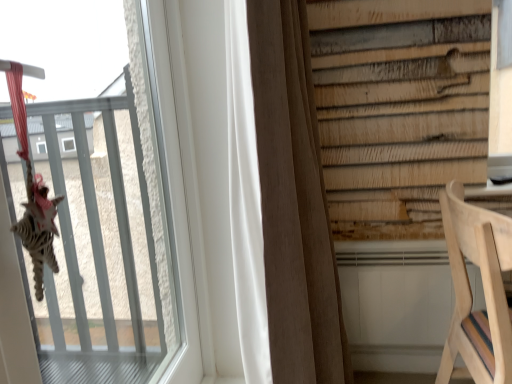
The width and height of the screenshot is (512, 384). What do you see at coordinates (109, 225) in the screenshot?
I see `transparent glass window at upper left` at bounding box center [109, 225].

You are a GUI agent. You are given a task and a screenshot of the screen. Output one action in this format:
    pyautogui.click(x=<x>, y=<y>)
    Task: Click on the natural wood chair at lower right
    
    Given the screenshot: What is the action you would take?
    pyautogui.click(x=471, y=292)

Find the location of a particular element. brown fabric curtain at center is located at coordinates (294, 202).

Which is more to the right, transparent glass window at upper left or brown fabric curtain at center?

brown fabric curtain at center is more to the right.

Can you confirm if transparent glass window at upper left is thinner than brown fabric curtain at center?

Yes.

Looking at this image, considering the sizes of objects transparent glass window at upper left and brown fabric curtain at center in the image provided, who is smaller, transparent glass window at upper left or brown fabric curtain at center?

transparent glass window at upper left.

Can you confirm if transparent glass window at upper left is taller than brown fabric curtain at center?

In fact, transparent glass window at upper left may be shorter than brown fabric curtain at center.

From the image's perspective, is transparent glass window at upper left located above or below natural wood chair at lower right?

transparent glass window at upper left is above natural wood chair at lower right.

Which object is positioned more to the right, transparent glass window at upper left or natural wood chair at lower right?

Positioned to the right is natural wood chair at lower right.

Considering the points (90, 210) and (488, 293), which point is behind, point (90, 210) or point (488, 293)?

Point (90, 210)

From the picture: Is brown fabric curtain at center in front of or behind natural wood chair at lower right in the image?

brown fabric curtain at center is positioned farther from the viewer than natural wood chair at lower right.

In the scene shown: Considering the relative sizes of brown fabric curtain at center and natural wood chair at lower right in the image provided, is brown fabric curtain at center bigger than natural wood chair at lower right?

Correct, brown fabric curtain at center is larger in size than natural wood chair at lower right.

Who is shorter, brown fabric curtain at center or natural wood chair at lower right?

natural wood chair at lower right is shorter.

Which object is thinner, brown fabric curtain at center or natural wood chair at lower right?

Thinner between the two is brown fabric curtain at center.

Based on their sizes in the image, would you say natural wood chair at lower right is bigger or smaller than brown fabric curtain at center?

Considering their sizes, natural wood chair at lower right takes up less space than brown fabric curtain at center.

Where is `furniture below the brown fabric curtain at center (from a real-world perspective)`? furniture below the brown fabric curtain at center (from a real-world perspective) is located at coordinates (471, 292).

Is natural wood chair at lower right far away from brown fabric curtain at center?

natural wood chair at lower right is actually quite close to brown fabric curtain at center.

Considering the positions of objects natural wood chair at lower right and brown fabric curtain at center in the image provided, who is in front, natural wood chair at lower right or brown fabric curtain at center?

natural wood chair at lower right is closer to the camera.

Between brown fabric curtain at center and transparent glass window at upper left, which one has less height?

Standing shorter between the two is transparent glass window at upper left.

This screenshot has height=384, width=512. I want to click on curtain behind the transparent glass window at upper left, so click(294, 202).

From a real-world perspective, is brown fabric curtain at center physically located above or below transparent glass window at upper left?

From a real-world perspective, brown fabric curtain at center is physically below transparent glass window at upper left.

Is natural wood chair at lower right outside of transparent glass window at upper left?

natural wood chair at lower right lies outside transparent glass window at upper left's area.

Which of these two, natural wood chair at lower right or transparent glass window at upper left, stands taller?

Standing taller between the two is transparent glass window at upper left.

Can you tell me how much natural wood chair at lower right and transparent glass window at upper left differ in facing direction?

The angular difference between natural wood chair at lower right and transparent glass window at upper left is 3.42 degrees.

Are natural wood chair at lower right and transparent glass window at upper left beside each other?

natural wood chair at lower right is not next to transparent glass window at upper left, and they're not touching.

Identify the location of curtain that appears behind the transparent glass window at upper left. The image size is (512, 384). (294, 202).

Locate an element on the screen. The height and width of the screenshot is (384, 512). window located in front of the natural wood chair at lower right is located at coordinates (109, 225).

Considering their positions, is transparent glass window at upper left positioned closer to natural wood chair at lower right than brown fabric curtain at center?

brown fabric curtain at center is positioned closer to the anchor natural wood chair at lower right.

Based on their spatial positions, is natural wood chair at lower right or brown fabric curtain at center closer to transparent glass window at upper left?

Among the two, brown fabric curtain at center is located nearer to transparent glass window at upper left.

Looking at the image, which one is located further to brown fabric curtain at center, transparent glass window at upper left or natural wood chair at lower right?

The object further to brown fabric curtain at center is transparent glass window at upper left.

Looking at the image, which one is located closer to natural wood chair at lower right, brown fabric curtain at center or transparent glass window at upper left?

Based on the image, brown fabric curtain at center appears to be nearer to natural wood chair at lower right.

Estimate the real-world distances between objects in this image. Which object is further from brown fabric curtain at center, natural wood chair at lower right or transparent glass window at upper left?

transparent glass window at upper left lies further to brown fabric curtain at center than the other object.

When comparing their distances from transparent glass window at upper left, does brown fabric curtain at center or natural wood chair at lower right seem further?

Among the two, natural wood chair at lower right is located further to transparent glass window at upper left.

Locate an element on the screen. curtain between transparent glass window at upper left and natural wood chair at lower right in the horizontal direction is located at coordinates (294, 202).